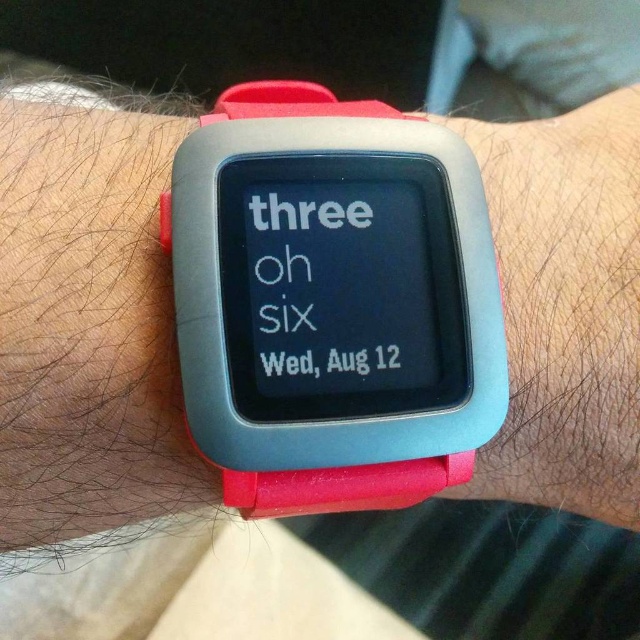
You are a watch repair technician examining a wrist with a smartwatch. You notice the rubber watch at center and the rubber band at center. Which object is positioned more to the left?

The rubber watch at center is positioned more to the left than the rubber band at center.

You are a photographer adjusting the focus on your camera. You have two points on the smartwatch to focus on, namely point (412, 260) and point (563, 248). Which point should you focus on first to ensure the closest object is in focus?

Point (412, 260) is closer to the viewer than point (563, 248), so you should focus on point (412, 260) first to ensure the closest object is in focus.